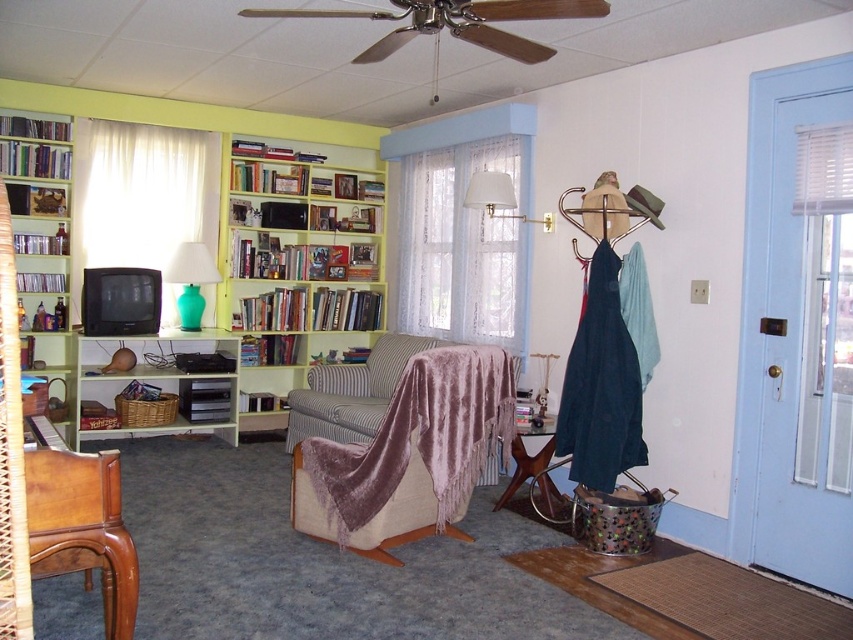
You are standing in the living room and want to take a photo of the point at coordinates point (450, 312). If your camera has a focal length of 50mm and you are 5.41 meters away from the point, what is the approximate angle of view required to capture the point in the center of your photo?

The point (450, 312) is 5.41 meters away from the camera. Using the formula for angle of view, the angle can be calculated as 2 times the arctangent of the sensor size divided by twice the focal length. However, without specific sensor dimensions, a general estimate using standard 35mm format would give an angle of approximately 46 degrees, allowing the point to be centered in the frame.

You are standing in the living room and want to take a photo of the yellow wood bookshelf at upper center using a camera. If the camera has a maximum focus range of 20 feet, will it be able to capture the bookshelf clearly?

The yellow wood bookshelf at upper center and the camera are 18.64 feet apart from each other. Since the camera can focus up to 20 feet, it is within range, so yes, the camera can capture the bookshelf clearly.

You are a delivery person trying to place a package that is 22 inches long on the space between the white lace curtain at center and the white fabric lampshade at upper center. Can the package fit in that space?

The distance between the white lace curtain at center and the white fabric lampshade at upper center is 21.54 inches, which is slightly shorter than the 22 inch package. The package will not fit in that space.